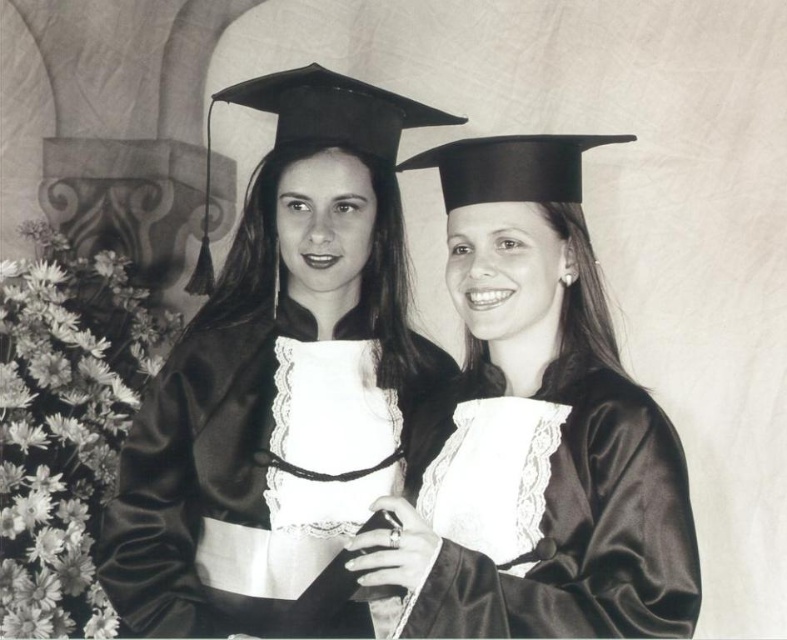
Question: Is satin black gown at center positioned before satin black graduation gown at center?

Choices:
 (A) no
 (B) yes

Answer: (A)

Question: Can you confirm if satin black gown at center is positioned to the left of satin black graduation gown at center?

Choices:
 (A) no
 (B) yes

Answer: (B)

Question: Which point is closer to the camera?

Choices:
 (A) satin black gown at center
 (B) satin black graduation gown at center

Answer: (B)

Question: Does satin black gown at center have a larger size compared to satin black graduation gown at center?

Choices:
 (A) no
 (B) yes

Answer: (B)